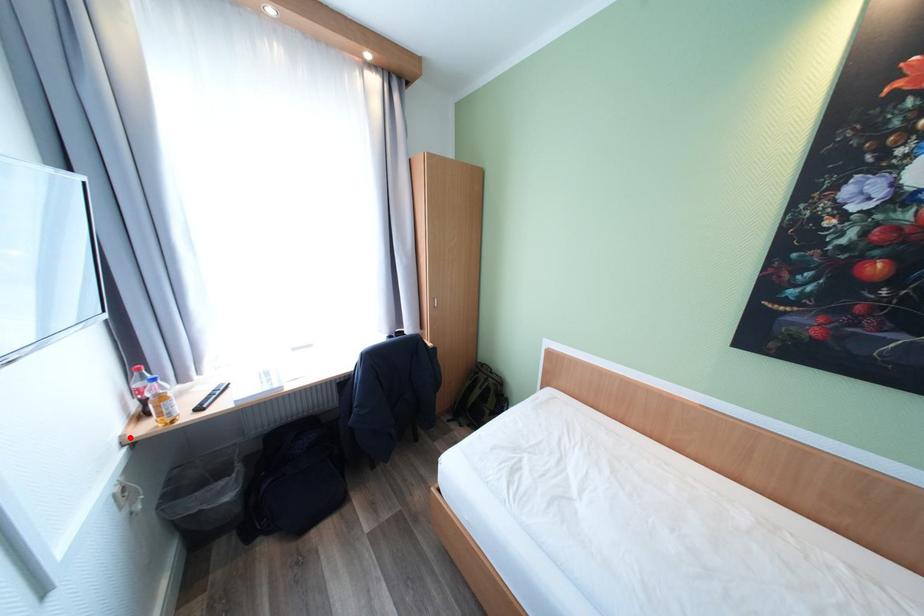
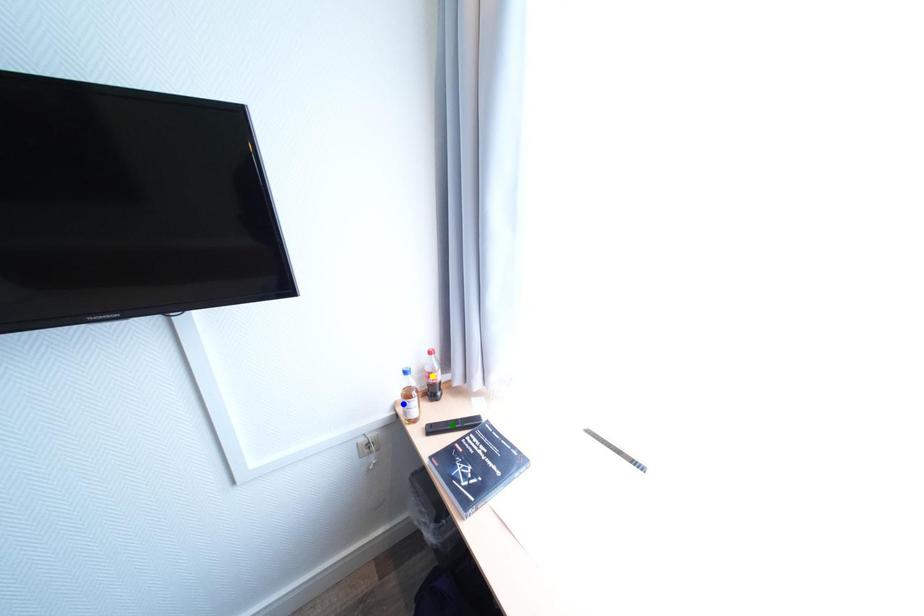
Question: I am providing you with two images of the same scene from different viewpoints. A red point is marked on the first image. You are given multiple points on the second image. Which point in image 2 is actually the same real-world point as the red point in image 1?

Choices:
 (A) yellow point
 (B) blue point
 (C) green point

Answer: (B)